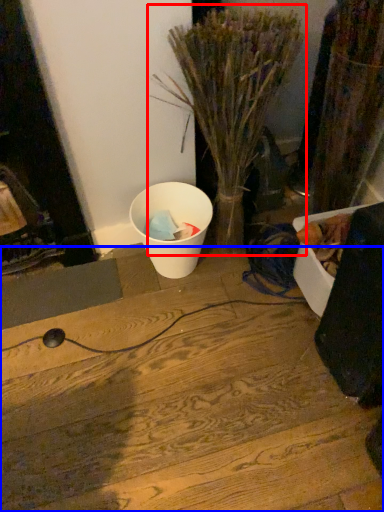
Question: Which of the following is the farthest to the observer, houseplant (highlighted by a red box) or wood (highlighted by a blue box)?

Choices:
 (A) houseplant
 (B) wood

Answer: (B)